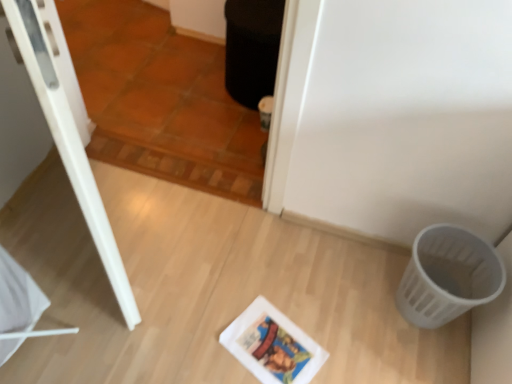
Question: In terms of width, does brown terracotta tile at upper center look wider or thinner when compared to matte white comic book at center?

Choices:
 (A) wide
 (B) thin

Answer: (B)

Question: Is brown terracotta tile at upper center inside or outside of matte white comic book at center?

Choices:
 (A) outside
 (B) inside

Answer: (A)

Question: Which is nearer to the white plastic basket at lower right?

Choices:
 (A) matte white comic book at center
 (B) brown terracotta tile at upper center

Answer: (A)

Question: Based on their relative distances, which object is nearer to the matte white comic book at center?

Choices:
 (A) brown terracotta tile at upper center
 (B) white plastic basket at lower right

Answer: (B)